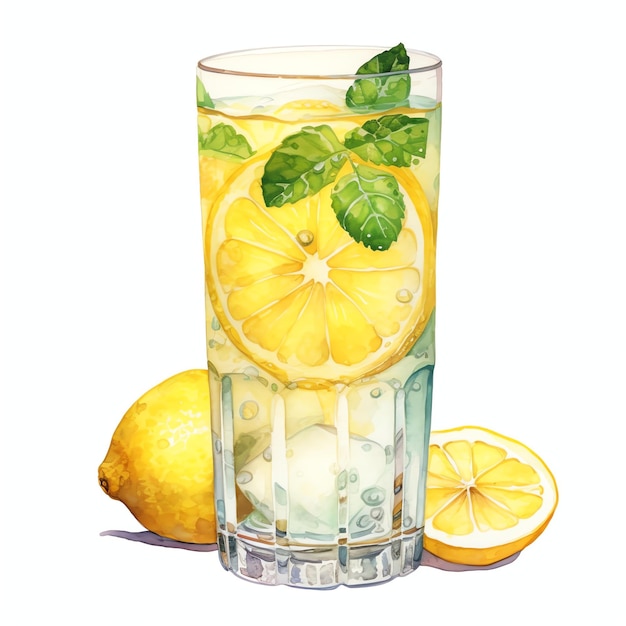
Find the location of a particular element. This screenshot has width=626, height=626. cup is located at coordinates (218, 344).